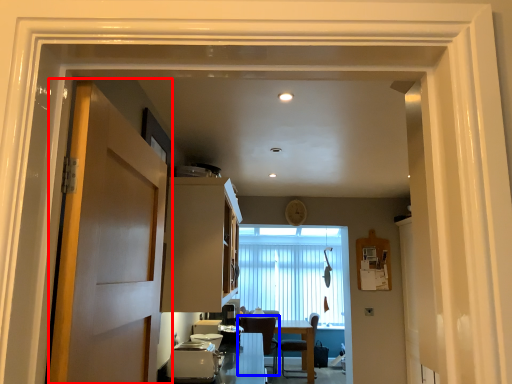
Question: Which of the following is the closest to the observer, door (highlighted by a red box) or chair (highlighted by a blue box)?

Choices:
 (A) door
 (B) chair

Answer: (A)